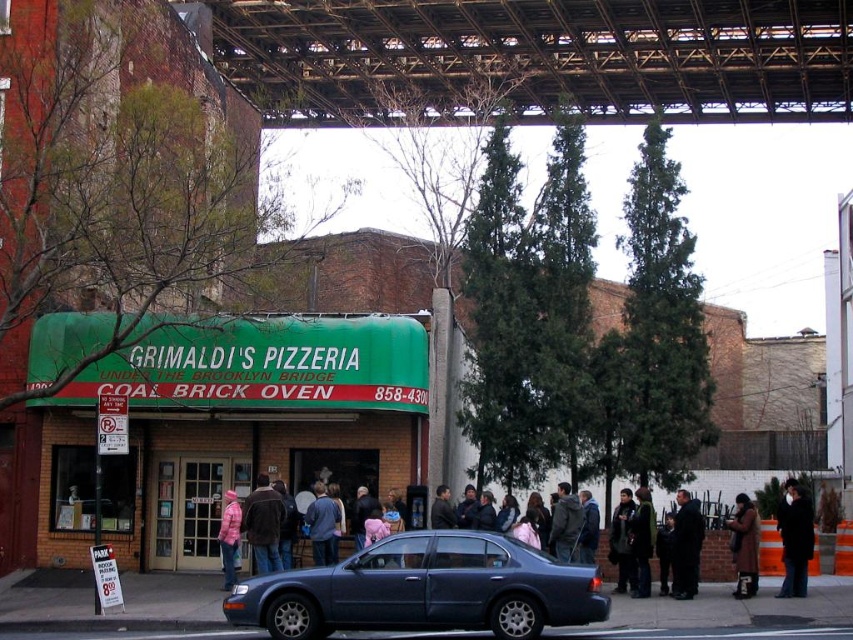
Can you confirm if dark blue car at center is wider than dark green jacket at center?

Indeed, dark blue car at center has a greater width compared to dark green jacket at center.

Who is positioned more to the right, dark blue car at center or dark green jacket at center?

dark blue car at center is more to the right.

Where is `dark blue car at center`? The width and height of the screenshot is (853, 640). dark blue car at center is located at coordinates (706, 541).

Does dark brown wooden beams at upper center appear on the left side of black wool coat at lower right?

Correct, you'll find dark brown wooden beams at upper center to the left of black wool coat at lower right.

Which is more to the left, dark brown wooden beams at upper center or black wool coat at lower right?

dark brown wooden beams at upper center

Where is `dark brown wooden beams at upper center`? The image size is (853, 640). dark brown wooden beams at upper center is located at coordinates (538, 58).

This screenshot has width=853, height=640. Identify the location of dark brown wooden beams at upper center. (538, 58).

Who is taller, black leather jacket at center or pink wool jacket at center?

Standing taller between the two is pink wool jacket at center.

Can you confirm if black leather jacket at center is positioned to the left of pink wool jacket at center?

No, black leather jacket at center is not to the left of pink wool jacket at center.

Who is more distant from viewer, (698, 560) or (231, 531)?

The point (231, 531) is behind.

This screenshot has height=640, width=853. I want to click on black leather jacket at center, so [685, 545].